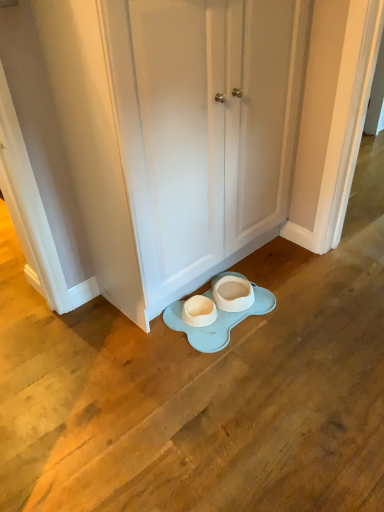
Question: Is white matte door at center positioned with its back to white matte porcelain at center?

Choices:
 (A) yes
 (B) no

Answer: (B)

Question: Is white matte door at center to the left of white matte porcelain at center from the viewer's perspective?

Choices:
 (A) no
 (B) yes

Answer: (A)

Question: Is white matte door at center in contact with white matte porcelain at center?

Choices:
 (A) no
 (B) yes

Answer: (A)

Question: Can we say white matte door at center lies outside white matte porcelain at center?

Choices:
 (A) yes
 (B) no

Answer: (A)

Question: Is white matte door at center at the right side of white matte porcelain at center?

Choices:
 (A) yes
 (B) no

Answer: (A)

Question: Is white matte door at center positioned behind white matte porcelain at center?

Choices:
 (A) yes
 (B) no

Answer: (B)

Question: Does white matte porcelain at center appear on the left side of white matte door at center?

Choices:
 (A) yes
 (B) no

Answer: (A)

Question: Could you tell me if white matte porcelain at center is turned towards white matte door at center?

Choices:
 (A) no
 (B) yes

Answer: (A)

Question: Is white matte porcelain at center directly adjacent to white matte door at center?

Choices:
 (A) no
 (B) yes

Answer: (A)

Question: From the image's perspective, is white matte porcelain at center beneath white matte door at center?

Choices:
 (A) yes
 (B) no

Answer: (A)

Question: Does white matte porcelain at center lie in front of white matte door at center?

Choices:
 (A) yes
 (B) no

Answer: (B)

Question: Is white matte porcelain at center turned away from white matte door at center?

Choices:
 (A) yes
 (B) no

Answer: (B)

Question: From the image's perspective, is white matte porcelain at center positioned above or below white matte door at center?

Choices:
 (A) below
 (B) above

Answer: (A)